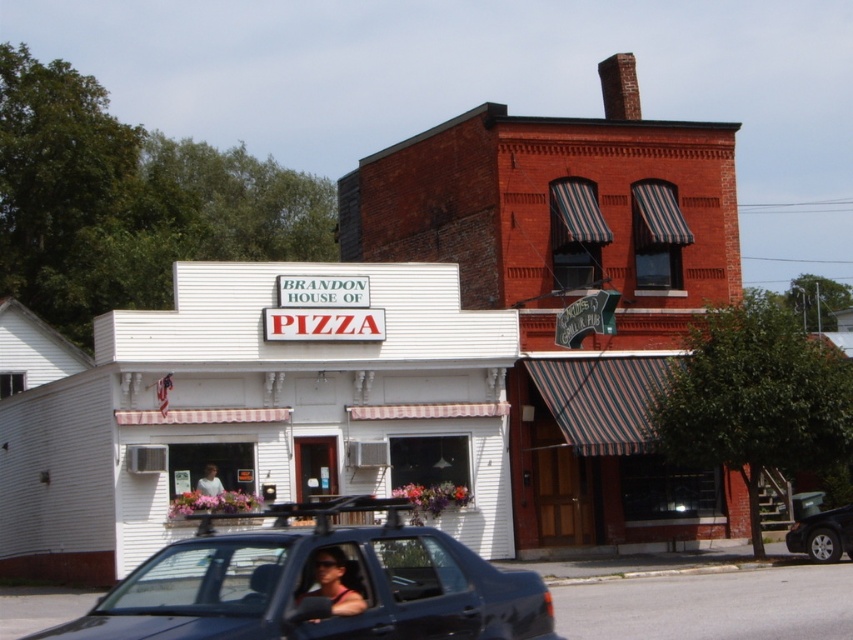
Which of these two, white woodshed at center or matte black truck at center, stands taller?

white woodshed at center

Does point (253, 349) lie in front of point (262, 529)?

No, (253, 349) is further to viewer.

Does point (20, 570) lie behind point (135, 634)?

Yes.

Find the location of a particular element. The height and width of the screenshot is (640, 853). white woodshed at center is located at coordinates (258, 410).

Is matte black truck at center below transparent plastic window at center?

Yes, matte black truck at center is below transparent plastic window at center.

Measure the distance from matte black truck at center to transparent plastic window at center.

matte black truck at center and transparent plastic window at center are 5.54 feet apart.

This screenshot has height=640, width=853. I want to click on matte black truck at center, so click(318, 584).

What do you see at coordinates (202, 579) in the screenshot? I see `transparent glass car window at lower center` at bounding box center [202, 579].

Is point (270, 541) more distant than point (332, 602)?

That is True.

I want to click on transparent glass car window at lower center, so click(x=202, y=579).

The image size is (853, 640). Identify the location of transparent glass car window at lower center. click(x=202, y=579).